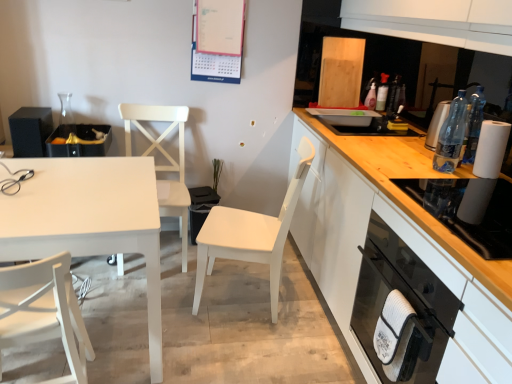
Image resolution: width=512 pixels, height=384 pixels. I want to click on vacant area that is in front of white matte chair at center, the second chair positioned from the back, so click(x=244, y=352).